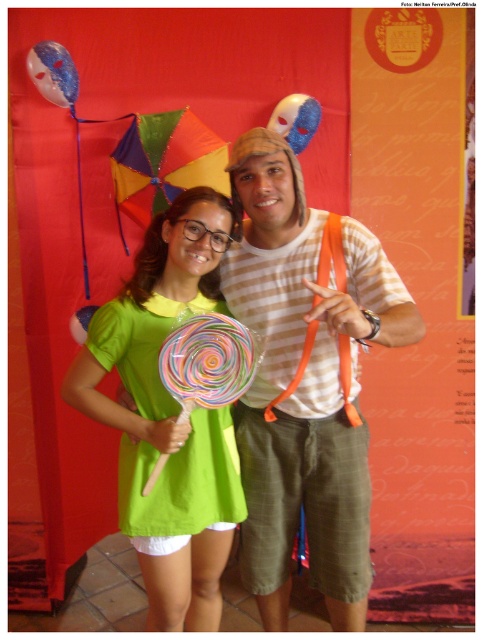
You are standing in front of the photo and want to touch the striped cotton shirt at center and the green matte dress at center. Which one can you reach first without moving your position?

The striped cotton shirt at center is closer to the viewer than the green matte dress at center, so you can reach it first without moving your position.

You are a photographer adjusting your camera settings. You notice two points in the image at coordinates point (x=264, y=188) and point (x=170, y=582). Which point should you focus on to ensure the subject closest to the camera is in sharp focus?

Point (x=264, y=188) is closer to the camera than point (x=170, y=582), so you should focus on point (x=264, y=188) to ensure the subject closest to the camera is in sharp focus.

You are a photographer setting up for a photo shoot. The two main subjects are wearing a striped cotton shirt at center and a green matte dress at center. You need to ensure there is at least 20 centimeters between them for proper lighting. Can they maintain the required distance based on their current positions?

The distance between the striped cotton shirt at center and the green matte dress at center is 23.74 centimeters, which exceeds the minimum requirement of 20 centimeters. Therefore, they can maintain the required distance for proper lighting.